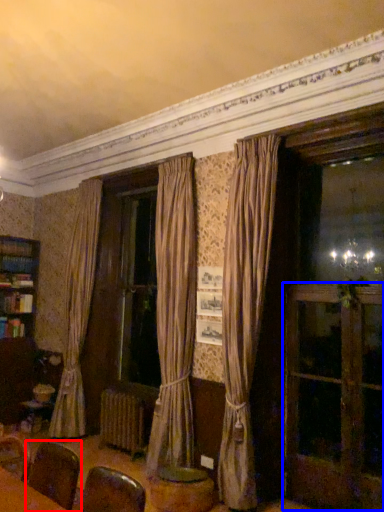
Question: Among these objects, which one is nearest to the camera, armchair (highlighted by a red box) or screen door (highlighted by a blue box)?

Choices:
 (A) armchair
 (B) screen door

Answer: (A)